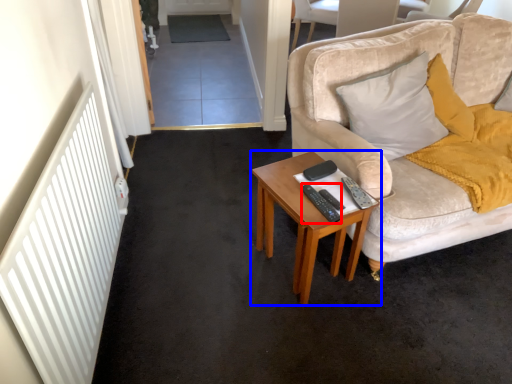
Question: Which object appears farthest to the camera in this image, remote control (highlighted by a red box) or table (highlighted by a blue box)?

Choices:
 (A) remote control
 (B) table

Answer: (A)